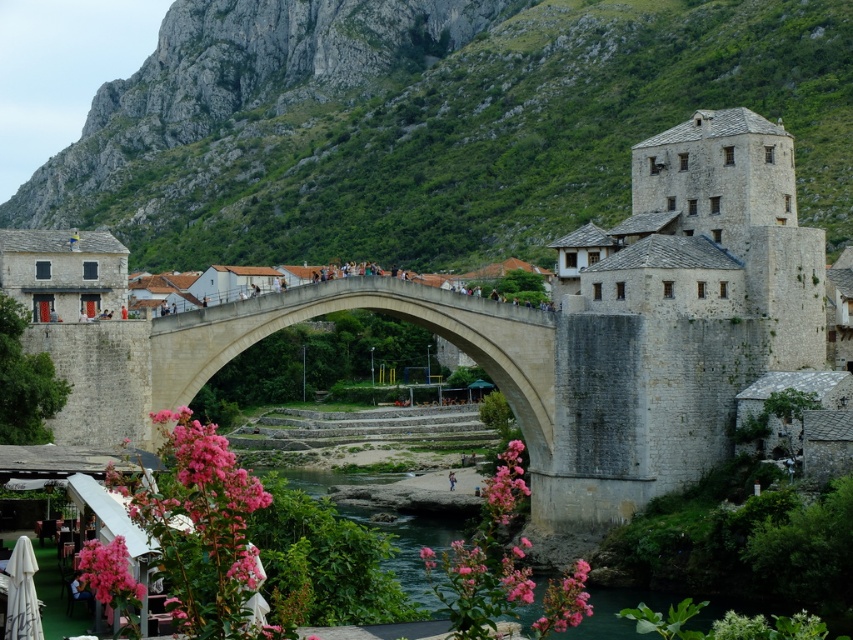
Question: Which of the following is the farthest from the observer?

Choices:
 (A) (656, 160)
 (B) (540, 636)

Answer: (A)

Question: Does green rocky mountain at upper center appear on the right side of pink matte flower at lower center?

Choices:
 (A) no
 (B) yes

Answer: (A)

Question: Where is stone castle at center located in relation to pink matte flower at lower left in the image?

Choices:
 (A) above
 (B) below

Answer: (A)

Question: Estimate the real-world distances between objects in this image. Which object is farther from the gray stone arch bridge at center?

Choices:
 (A) pink matte flower at center
 (B) pink matte flower at lower left
 (C) green rocky mountain at upper center

Answer: (C)

Question: Which point is closer to the camera?

Choices:
 (A) pink matte flower at center
 (B) pink matte flower at lower left

Answer: (B)

Question: Does gray stone arch bridge at center appear under pink matte flower at lower left?

Choices:
 (A) yes
 (B) no

Answer: (B)